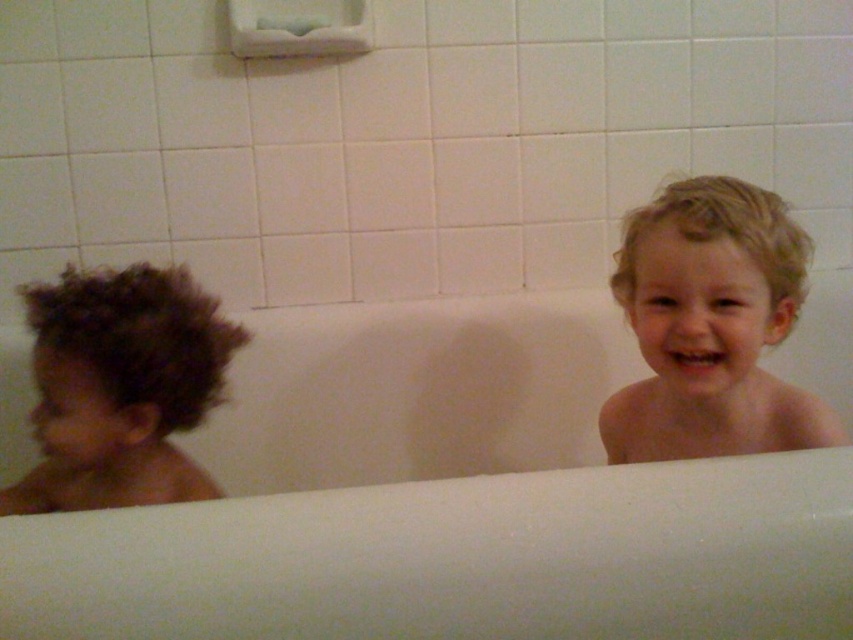
You are a parent trying to locate two points in the bathroom. The first point is at coordinate point (12, 435) and the second is at point (161, 275). Which point is closer to you as you stand in front of the bathtub?

Point (12, 435) is closer to you because it is further to the viewer than point (161, 275).

You are a parent looking into the bathtub where your children are playing. You notice the blonde hair at right and the dark curly hair at left. Which child is closer to you, the parent, standing at the edge of the bathtub?

The blonde hair at right is closer to you because the dark curly hair at left is behind it, meaning the child with blonde hair at right is in front and thus nearer to your position at the edge of the bathtub.

You are a parent trying to determine if your child with dark curly hair at left can safely stand inside the white smooth bathtub at center without touching the top edge. Based on the height comparison between the two, can they stand upright without their hair touching the tub?

The white smooth bathtub at center has a greater height compared to dark curly hair at left. Since the tub is taller than the child hair, the child can stand upright without their hair touching the tub edge.